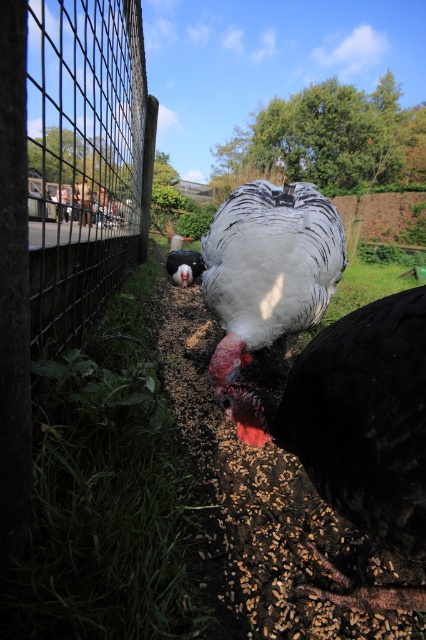
You are a farmer checking the turkeys in the pen. You need to determine which turkey has a greater width between the white feathered turkey at center and the shiny black bird at center. Which one is wider?

The white feathered turkey at center is wider than the shiny black bird at center according to the description.

You are a farmer checking the turkeys in the field. You notice the white glossy turkey at center and the shiny black bird at center. Which one is positioned lower in the image?

The white glossy turkey at center is positioned below the shiny black bird at center, so it is lower in the image.

You are a farmer who needs to identify which turkey is healthier based on their body shape. According to the image, which turkey is thinner between the white glossy turkey at center and the white feathered turkey at center?

The white glossy turkey at center is thinner than the white feathered turkey at center, so the white glossy turkey at center would be considered less healthy if body thickness is an indicator of health.